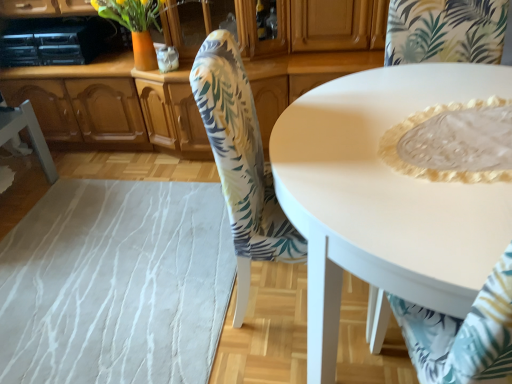
Image resolution: width=512 pixels, height=384 pixels. In order to click on wooden cabinet at center in this screenshot , I will do `click(189, 71)`.

At what (x,y) coordinates should I click in order to perform the action: click on white glossy table at center. Please return your answer as a coordinate pair (x, y). The image size is (512, 384). Looking at the image, I should click on [x=384, y=198].

The width and height of the screenshot is (512, 384). Describe the element at coordinates (29, 135) in the screenshot. I see `white fabric chair at lower left, which is the first chair in left-to-right order` at that location.

Where is `wooden cabinet at center`? This screenshot has height=384, width=512. wooden cabinet at center is located at coordinates (189, 71).

Considering the relative sizes of wooden cabinet at center and white glossy table at center in the image provided, is wooden cabinet at center shorter than white glossy table at center?

Incorrect, the height of wooden cabinet at center does not fall short of that of white glossy table at center.

From the picture: From the image's perspective, which one is positioned lower, wooden cabinet at center or white glossy table at center?

white glossy table at center, from the image's perspective.

From a real-world perspective, is wooden cabinet at center below white glossy table at center?

Actually, wooden cabinet at center is physically above white glossy table at center in the real world.

Would you say white glossy table at center is part of wooden cabinet at center's contents?

Definitely not — white glossy table at center is not inside wooden cabinet at center.

From the image's perspective, which object appears higher, white glossy table at center or wooden cabinet at center?

wooden cabinet at center.

From a real-world perspective, does white glossy table at center stand above wooden cabinet at center?

Incorrect, from a real-world perspective, white glossy table at center is lower than wooden cabinet at center.

Which is closer, (503, 190) or (94, 135)?

Point (503, 190).

Which of these two, white glossy table at center or wooden cabinet at center, is bigger?

wooden cabinet at center is bigger.

Based on their positions, is white fabric chair at lower left, placed as the 3th chair when sorted from right to left, located to the left or right of floral fabric chair at center, the second chair positioned from the left?

white fabric chair at lower left, placed as the 3th chair when sorted from right to left, is positioned on floral fabric chair at center, the second chair positioned from the left,'s left side.

Is white fabric chair at lower left, placed as the 3th chair when sorted from right to left, situated inside floral fabric chair at center, the second chair positioned from the left, or outside?

The correct answer is: outside.

Can you tell me how much white fabric chair at lower left, which is the first chair in left-to-right order, and floral fabric chair at center, the second chair positioned from the left, differ in facing direction?

The angular difference between white fabric chair at lower left, which is the first chair in left-to-right order, and floral fabric chair at center, the second chair positioned from the left, is 6.69 degrees.

How far apart are white fabric chair at lower left, placed as the 3th chair when sorted from right to left, and floral fabric chair at center, the second chair viewed from the right?

white fabric chair at lower left, placed as the 3th chair when sorted from right to left, and floral fabric chair at center, the second chair viewed from the right, are 4.77 feet apart from each other.

Could you tell me if wooden cabinet at center is turned towards white lace tablecloth at lower right, the third chair in the left-to-right sequence?

Yes, wooden cabinet at center is aimed at white lace tablecloth at lower right, the third chair in the left-to-right sequence.

Does point (1, 3) come farther from viewer compared to point (472, 50)?

Yes.

Consider the image. From the image's perspective, which is above, wooden cabinet at center or white lace tablecloth at lower right, which ranks as the first chair in right-to-left order?

From the image's view, wooden cabinet at center is above.

From a real-world perspective, who is located lower, wooden cabinet at center or white lace tablecloth at lower right, the third chair in the left-to-right sequence?

wooden cabinet at center.

Which point is more forward, (294,87) or (45,155)?

The point (294,87) is closer to the camera.

Where is `chair on the left of the wooden cabinet at center`? chair on the left of the wooden cabinet at center is located at coordinates (29, 135).

Is there a large distance between wooden cabinet at center and white fabric chair at lower left, which is the first chair in left-to-right order?

wooden cabinet at center is near white fabric chair at lower left, which is the first chair in left-to-right order, not far away.

Is floral fabric chair at center, the second chair viewed from the right, positioned beyond the bounds of white lace tablecloth at lower right, the third chair in the left-to-right sequence?

floral fabric chair at center, the second chair viewed from the right, lies outside white lace tablecloth at lower right, the third chair in the left-to-right sequence,'s area.

Which object is positioned more to the left, floral fabric chair at center, the second chair viewed from the right, or white lace tablecloth at lower right, which ranks as the first chair in right-to-left order?

Positioned to the left is floral fabric chair at center, the second chair viewed from the right.

Considering their positions, is floral fabric chair at center, the second chair positioned from the left, located in front of or behind white lace tablecloth at lower right, which ranks as the first chair in right-to-left order?

Clearly, floral fabric chair at center, the second chair positioned from the left, is behind white lace tablecloth at lower right, which ranks as the first chair in right-to-left order.

From the image's perspective, between white lace tablecloth at lower right, which ranks as the first chair in right-to-left order, and white fabric chair at lower left, which is the first chair in left-to-right order, who is located below?

white lace tablecloth at lower right, which ranks as the first chair in right-to-left order, from the image's perspective.

Is white lace tablecloth at lower right, the third chair in the left-to-right sequence, taller or shorter than white fabric chair at lower left, placed as the 3th chair when sorted from right to left?

Considering their sizes, white lace tablecloth at lower right, the third chair in the left-to-right sequence, has more height than white fabric chair at lower left, placed as the 3th chair when sorted from right to left.

In terms of size, does white lace tablecloth at lower right, the third chair in the left-to-right sequence, appear bigger or smaller than white fabric chair at lower left, placed as the 3th chair when sorted from right to left?

white lace tablecloth at lower right, the third chair in the left-to-right sequence, is bigger than white fabric chair at lower left, placed as the 3th chair when sorted from right to left.

Can you confirm if white lace tablecloth at lower right, the third chair in the left-to-right sequence, is positioned to the right of white fabric chair at lower left, placed as the 3th chair when sorted from right to left?

Yes.

You are a GUI agent. You are given a task and a screenshot of the screen. Output one action in this format:
    pyautogui.click(x=<x>, y=<y>)
    Task: Click on the coffee table that appears below the wooden cabinet at center (from the image's perspective)
    Image resolution: width=512 pixels, height=384 pixels.
    Given the screenshot: What is the action you would take?
    pyautogui.click(x=384, y=198)

This screenshot has width=512, height=384. I want to click on cabinetry behind the white glossy table at center, so click(189, 71).

Looking at the image, which one is located closer to white lace tablecloth at lower right, which ranks as the first chair in right-to-left order, floral fabric chair at center, the second chair viewed from the right, or white glossy table at center?

Based on the image, white glossy table at center appears to be nearer to white lace tablecloth at lower right, which ranks as the first chair in right-to-left order.

Based on their spatial positions, is white fabric chair at lower left, placed as the 3th chair when sorted from right to left, or white lace tablecloth at lower right, which ranks as the first chair in right-to-left order, closer to white glossy table at center?

white lace tablecloth at lower right, which ranks as the first chair in right-to-left order, lies closer to white glossy table at center than the other object.

When comparing their distances from white fabric chair at lower left, which is the first chair in left-to-right order, does wooden cabinet at center or white glossy table at center seem closer?

wooden cabinet at center.

Estimate the real-world distances between objects in this image. Which object is further from wooden cabinet at center, white fabric chair at lower left, placed as the 3th chair when sorted from right to left, or white lace tablecloth at lower right, which ranks as the first chair in right-to-left order?

The object further to wooden cabinet at center is white lace tablecloth at lower right, which ranks as the first chair in right-to-left order.

From the image, which object appears to be nearer to white fabric chair at lower left, which is the first chair in left-to-right order, wooden cabinet at center or floral fabric chair at center, the second chair viewed from the right?

wooden cabinet at center lies closer to white fabric chair at lower left, which is the first chair in left-to-right order, than the other object.

Which object lies further to the anchor point white lace tablecloth at lower right, the third chair in the left-to-right sequence, white fabric chair at lower left, placed as the 3th chair when sorted from right to left, or wooden cabinet at center?

Among the two, white fabric chair at lower left, placed as the 3th chair when sorted from right to left, is located further to white lace tablecloth at lower right, the third chair in the left-to-right sequence.

When comparing their distances from white glossy table at center, does floral fabric chair at center, the second chair viewed from the right, or white fabric chair at lower left, placed as the 3th chair when sorted from right to left, seem further?

white fabric chair at lower left, placed as the 3th chair when sorted from right to left, lies further to white glossy table at center than the other object.

Based on the photo, based on their spatial positions, is white fabric chair at lower left, which is the first chair in left-to-right order, or floral fabric chair at center, the second chair positioned from the left, closer to wooden cabinet at center?

white fabric chair at lower left, which is the first chair in left-to-right order, is positioned closer to the anchor wooden cabinet at center.

Locate an element on the screen. This screenshot has height=384, width=512. chair located between white fabric chair at lower left, placed as the 3th chair when sorted from right to left, and white lace tablecloth at lower right, the third chair in the left-to-right sequence, in the left-right direction is located at coordinates (241, 162).

Locate an element on the screen. This screenshot has height=384, width=512. coffee table between white lace tablecloth at lower right, the third chair in the left-to-right sequence, and wooden cabinet at center from front to back is located at coordinates pyautogui.click(x=384, y=198).

I want to click on cabinetry between white fabric chair at lower left, placed as the 3th chair when sorted from right to left, and white glossy table at center, so click(189, 71).

I want to click on cabinetry between white fabric chair at lower left, placed as the 3th chair when sorted from right to left, and floral fabric chair at center, the second chair viewed from the right, in the horizontal direction, so click(x=189, y=71).